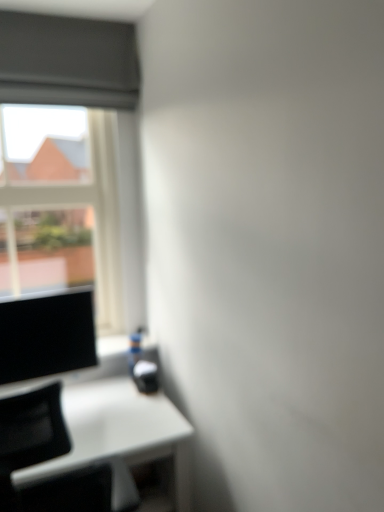
Question: In terms of width, does matte black monitor at left look wider or thinner when compared to white glossy table at lower left?

Choices:
 (A) wide
 (B) thin

Answer: (B)

Question: Considering the positions of matte black monitor at left and white glossy table at lower left in the image, is matte black monitor at left bigger or smaller than white glossy table at lower left?

Choices:
 (A) small
 (B) big

Answer: (A)

Question: Which is nearer to the matte black monitor at left?

Choices:
 (A) transparent glass window at upper left
 (B) white glossy table at lower left

Answer: (B)

Question: Estimate the real-world distances between objects in this image. Which object is closer to the white glossy table at lower left?

Choices:
 (A) matte black monitor at left
 (B) transparent glass window at upper left

Answer: (A)